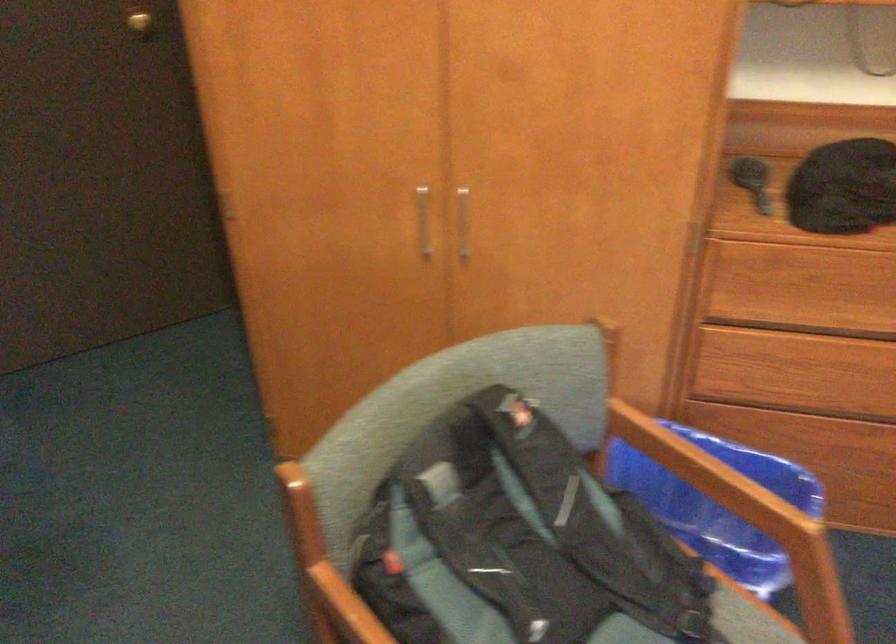
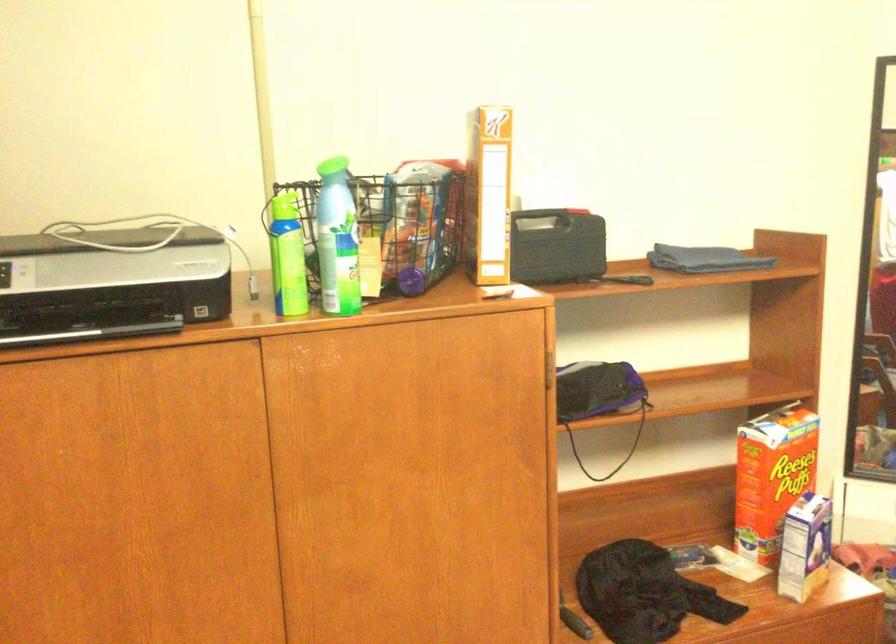
Consider the image. How did the camera likely rotate?

The camera's rotation is toward right-up.